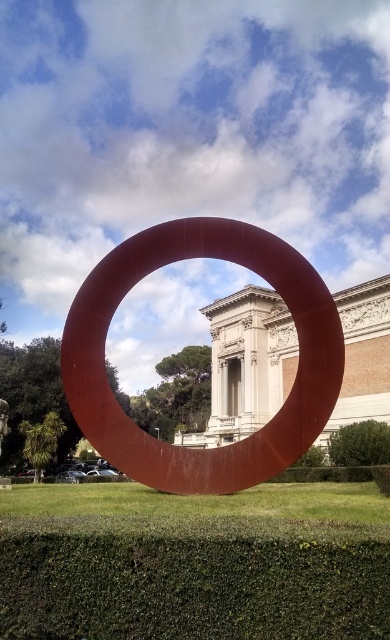
You are an artist planning to paint this scene. You need to ensure that the matte red ring at center and the green leafy hedge at lower right are proportionally accurate. Which object should you make wider in your painting to maintain the correct scale?

The matte red ring at center should be made wider in the painting since its width is larger than the green leafy hedge at lower right according to the description.

You are standing in front of the red circular sculpture and see two points marked in the image. The first point is at coordinates point (244, 467) and the second is at point (372, 456). Which point is closer to you?

Point (244, 467) is in front of point (372, 456), so it is closer to you.

You are standing in front of the red circular sculpture and want to take a photo that includes both the matte red ring at center and the green leafy hedge at lower right. Which object should you position closer to the left side of your camera frame?

The matte red ring at center should be positioned closer to the left side of your camera frame since it is already located to the left of the green leafy hedge at lower right.